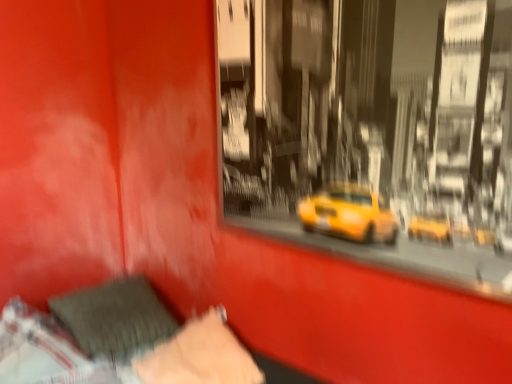
Question: From the image's perspective, is velvet-like gray pillow at lower left under velvety gray pillow at lower left, the second pillow in the right-to-left sequence?

Choices:
 (A) no
 (B) yes

Answer: (B)

Question: Does velvet-like gray pillow at lower left have a smaller size compared to velvety gray pillow at lower left, the second pillow in the right-to-left sequence?

Choices:
 (A) no
 (B) yes

Answer: (A)

Question: Can you confirm if velvet-like gray pillow at lower left is positioned to the left of velvety gray pillow at lower left, positioned as the first pillow in left-to-right order?

Choices:
 (A) yes
 (B) no

Answer: (B)

Question: Is velvet-like gray pillow at lower left surrounding velvety gray pillow at lower left, positioned as the first pillow in left-to-right order?

Choices:
 (A) yes
 (B) no

Answer: (A)

Question: Is velvet-like gray pillow at lower left not close to velvety gray pillow at lower left, the second pillow in the right-to-left sequence?

Choices:
 (A) no
 (B) yes

Answer: (A)

Question: From a real-world perspective, is velvet-like gray pillow at lower left physically located above or below velvety black pillow at lower left, positioned as the first pillow in right-to-left order?

Choices:
 (A) below
 (B) above

Answer: (B)

Question: Considering the positions of velvet-like gray pillow at lower left and velvety black pillow at lower left, marked as the 2th pillow in a left-to-right arrangement, in the image, is velvet-like gray pillow at lower left bigger or smaller than velvety black pillow at lower left, marked as the 2th pillow in a left-to-right arrangement,?

Choices:
 (A) big
 (B) small

Answer: (A)

Question: Is velvet-like gray pillow at lower left in front of or behind velvety black pillow at lower left, marked as the 2th pillow in a left-to-right arrangement, in the image?

Choices:
 (A) behind
 (B) front

Answer: (B)

Question: Considering the positions of velvet-like gray pillow at lower left and velvety black pillow at lower left, positioned as the first pillow in right-to-left order, in the image, is velvet-like gray pillow at lower left wider or thinner than velvety black pillow at lower left, positioned as the first pillow in right-to-left order,?

Choices:
 (A) wide
 (B) thin

Answer: (A)

Question: Is velvety gray pillow at lower left, positioned as the first pillow in left-to-right order, inside or outside of velvet-like gray pillow at lower left?

Choices:
 (A) outside
 (B) inside

Answer: (B)

Question: Based on their sizes in the image, would you say velvety gray pillow at lower left, positioned as the first pillow in left-to-right order, is bigger or smaller than velvet-like gray pillow at lower left?

Choices:
 (A) big
 (B) small

Answer: (B)

Question: Is velvety gray pillow at lower left, the second pillow in the right-to-left sequence, in front of or behind velvet-like gray pillow at lower left in the image?

Choices:
 (A) behind
 (B) front

Answer: (A)

Question: Does point (168, 336) appear closer or farther from the camera than point (224, 334)?

Choices:
 (A) farther
 (B) closer

Answer: (A)

Question: From the image's perspective, is velvety black pillow at lower left, marked as the 2th pillow in a left-to-right arrangement, positioned above or below velvety gray pillow at lower left, positioned as the first pillow in left-to-right order?

Choices:
 (A) above
 (B) below

Answer: (B)

Question: Relative to velvety gray pillow at lower left, the second pillow in the right-to-left sequence, is velvety black pillow at lower left, positioned as the first pillow in right-to-left order, in front or behind?

Choices:
 (A) front
 (B) behind

Answer: (A)